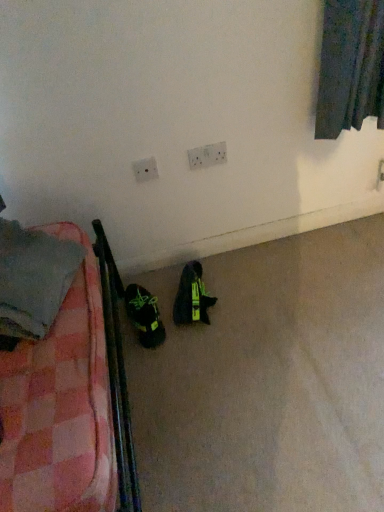
Question: Considering the relative sizes of plaid fabric blanket at left and white plastic electric outlet at upper center, the 1th electric outlet in the left-to-right sequence, in the image provided, is plaid fabric blanket at left shorter than white plastic electric outlet at upper center, the 1th electric outlet in the left-to-right sequence,?

Choices:
 (A) no
 (B) yes

Answer: (A)

Question: Can you confirm if plaid fabric blanket at left is smaller than white plastic electric outlet at upper center, the 1th electric outlet in the left-to-right sequence?

Choices:
 (A) yes
 (B) no

Answer: (B)

Question: Is plaid fabric blanket at left positioned beyond the bounds of white plastic electric outlet at upper center, which is the second electric outlet in right-to-left order?

Choices:
 (A) yes
 (B) no

Answer: (A)

Question: From a real-world perspective, is plaid fabric blanket at left on white plastic electric outlet at upper center, which is the second electric outlet in right-to-left order?

Choices:
 (A) yes
 (B) no

Answer: (A)

Question: Is plaid fabric blanket at left facing away from white plastic electric outlet at upper center, which is the second electric outlet in right-to-left order?

Choices:
 (A) no
 (B) yes

Answer: (A)

Question: From the image's perspective, is plaid fabric blanket at left beneath white plastic electric outlet at upper center, the 1th electric outlet in the left-to-right sequence?

Choices:
 (A) no
 (B) yes

Answer: (B)

Question: Can you confirm if green synthetic shoe at center, which ranks as the first footwear in right-to-left order, is taller than plaid fabric blanket at left?

Choices:
 (A) no
 (B) yes

Answer: (A)

Question: Is green synthetic shoe at center, which ranks as the first footwear in right-to-left order, wider than plaid fabric blanket at left?

Choices:
 (A) yes
 (B) no

Answer: (B)

Question: Considering the relative positions of green synthetic shoe at center, which ranks as the first footwear in right-to-left order, and plaid fabric blanket at left in the image provided, is green synthetic shoe at center, which ranks as the first footwear in right-to-left order, to the right of plaid fabric blanket at left from the viewer's perspective?

Choices:
 (A) yes
 (B) no

Answer: (A)

Question: From a real-world perspective, is green synthetic shoe at center, which appears as the second footwear when viewed from the left, under plaid fabric blanket at left?

Choices:
 (A) yes
 (B) no

Answer: (A)

Question: Does green synthetic shoe at center, which ranks as the first footwear in right-to-left order, come in front of plaid fabric blanket at left?

Choices:
 (A) yes
 (B) no

Answer: (B)

Question: From a real-world perspective, is green synthetic shoe at center, which ranks as the first footwear in right-to-left order, on plaid fabric blanket at left?

Choices:
 (A) no
 (B) yes

Answer: (A)

Question: Can you confirm if green matte sneakers at lower left, positioned as the first footwear in left-to-right order, is taller than white plastic electric outlet at upper center, the 2th electric outlet in the left-to-right sequence?

Choices:
 (A) no
 (B) yes

Answer: (B)